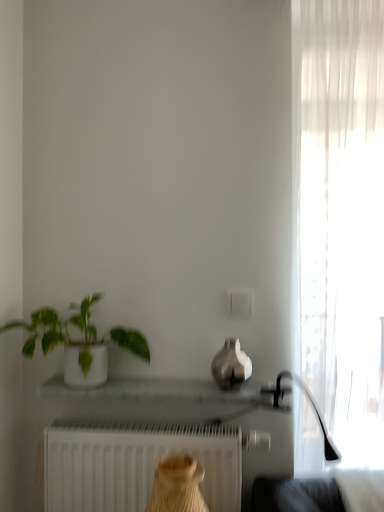
Question: Is white matte radiator at lower center to the right of white sheer curtain at right from the viewer's perspective?

Choices:
 (A) no
 (B) yes

Answer: (A)

Question: Does white matte radiator at lower center have a larger size compared to white sheer curtain at right?

Choices:
 (A) no
 (B) yes

Answer: (A)

Question: Considering the relative positions of white matte radiator at lower center and white sheer curtain at right in the image provided, is white matte radiator at lower center behind white sheer curtain at right?

Choices:
 (A) yes
 (B) no

Answer: (A)

Question: Is white matte radiator at lower center thinner than white sheer curtain at right?

Choices:
 (A) no
 (B) yes

Answer: (B)

Question: Could you tell me if white matte radiator at lower center is facing white sheer curtain at right?

Choices:
 (A) yes
 (B) no

Answer: (B)

Question: Is white matte radiator at lower center located outside white sheer curtain at right?

Choices:
 (A) no
 (B) yes

Answer: (B)

Question: From a real-world perspective, does white sheer curtain at right stand above white matte radiator at lower center?

Choices:
 (A) no
 (B) yes

Answer: (B)

Question: Can you confirm if white sheer curtain at right is thinner than white matte radiator at lower center?

Choices:
 (A) yes
 (B) no

Answer: (B)

Question: Is white sheer curtain at right smaller than white matte radiator at lower center?

Choices:
 (A) no
 (B) yes

Answer: (A)

Question: From the image's perspective, is white sheer curtain at right below white matte radiator at lower center?

Choices:
 (A) yes
 (B) no

Answer: (B)

Question: Is white sheer curtain at right positioned far away from white matte radiator at lower center?

Choices:
 (A) no
 (B) yes

Answer: (A)

Question: Can you confirm if white sheer curtain at right is bigger than white matte radiator at lower center?

Choices:
 (A) yes
 (B) no

Answer: (A)

Question: Are satin silver vase at center and white matte radiator at lower center far apart?

Choices:
 (A) yes
 (B) no

Answer: (B)